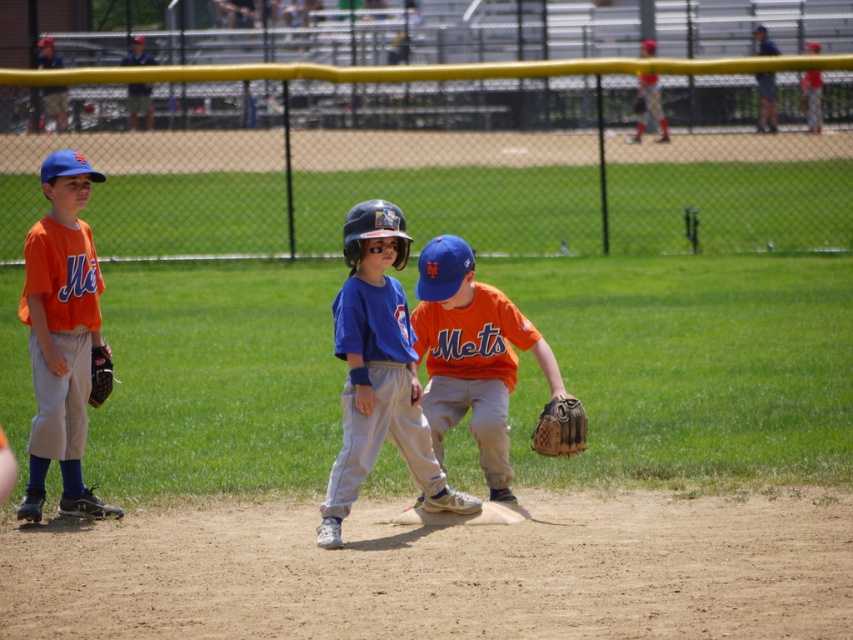
Question: Considering the relative positions of blue matte baseball cap at center and brown leather baseball glove at lower center in the image provided, where is blue matte baseball cap at center located with respect to brown leather baseball glove at lower center?

Choices:
 (A) above
 (B) below

Answer: (A)

Question: Does blue matte baseball cap at center appear over brown leather glove at lower left?

Choices:
 (A) yes
 (B) no

Answer: (B)

Question: Which object is the farthest from the brown leather glove at lower left?

Choices:
 (A) orange matte baseball glove at center
 (B) matte orange jersey at left
 (C) brown leather baseball glove at lower center
 (D) blue matte baseball cap at center

Answer: (C)

Question: Can you confirm if orange matte baseball glove at center is bigger than brown leather glove at lower left?

Choices:
 (A) yes
 (B) no

Answer: (A)

Question: Estimate the real-world distances between objects in this image. Which object is farther from the brown leather baseball glove at lower center?

Choices:
 (A) matte orange jersey at left
 (B) orange matte baseball glove at center
 (C) blue matte baseball cap at center
 (D) brown leather glove at lower left

Answer: (A)

Question: Which of the following is the closest to the observer?

Choices:
 (A) orange matte baseball glove at center
 (B) brown leather glove at lower left
 (C) matte orange jersey at left

Answer: (A)